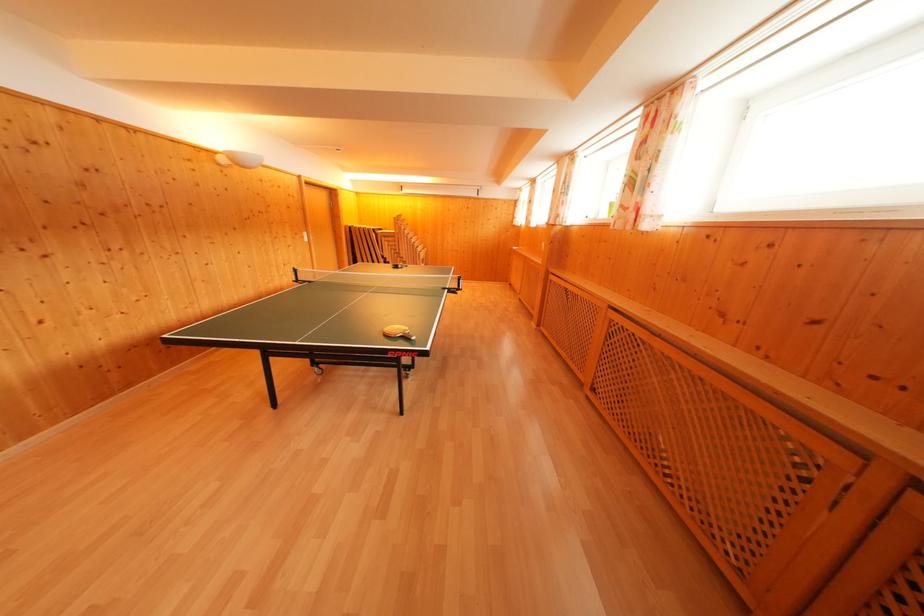
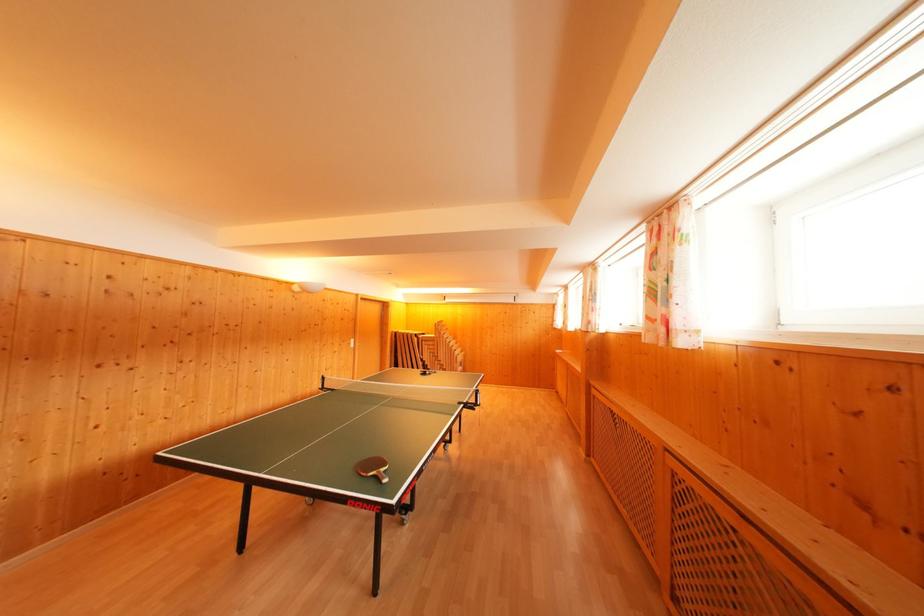
Where in the second image is the point corresponding to the point at 407,259 from the first image?

(445, 362)